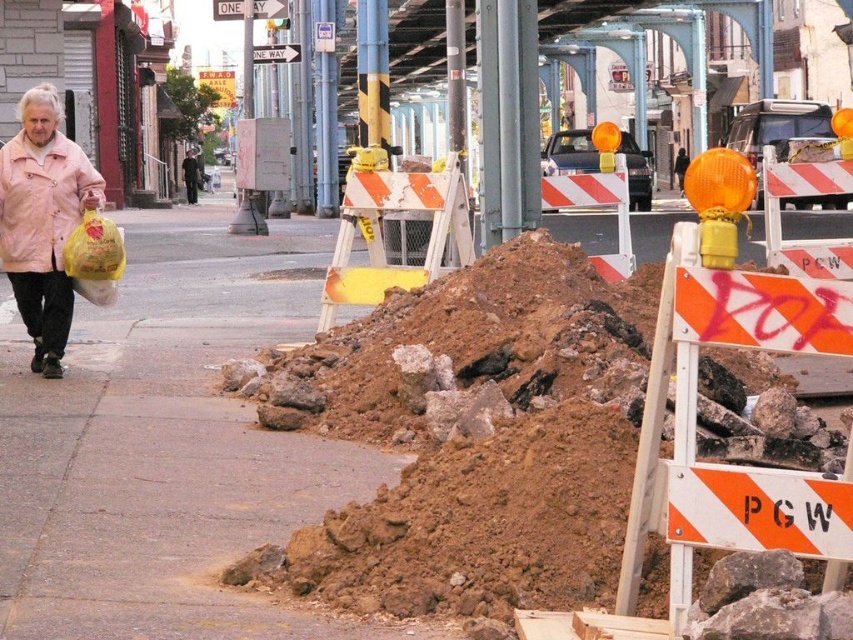
Looking at this image, does white plastic sign at upper center come in front of white plastic one way sign at upper center?

Yes.

Which is more to the right, white plastic sign at upper center or white plastic one way sign at upper center?

white plastic one way sign at upper center is more to the right.

Locate an element on the screen. white plastic sign at upper center is located at coordinates (270, 8).

Which is more to the right, pink matte jacket at left or white plastic sign at upper center?

pink matte jacket at left

Between pink matte jacket at left and white plastic sign at upper center, which one is positioned lower?

pink matte jacket at left is below.

Between point (27, 332) and point (236, 17), which one is positioned in front?

Positioned in front is point (27, 332).

You are a GUI agent. You are given a task and a screenshot of the screen. Output one action in this format:
    pyautogui.click(x=<x>, y=<y>)
    Task: Click on the pink matte jacket at left
    
    Given the screenshot: What is the action you would take?
    pyautogui.click(x=42, y=221)

Is orange/white striped sign at lower right thinner than white plastic sign at upper center?

Indeed, orange/white striped sign at lower right has a lesser width compared to white plastic sign at upper center.

Between point (735, 540) and point (270, 10), which one is positioned in front?

Point (735, 540)

Which is in front, point (791, 481) or point (231, 17)?

Positioned in front is point (791, 481).

At what (x,y) coordinates should I click in order to perform the action: click on orange/white striped sign at lower right. Please return your answer as a coordinate pair (x, y). Image resolution: width=853 pixels, height=640 pixels. Looking at the image, I should click on (759, 509).